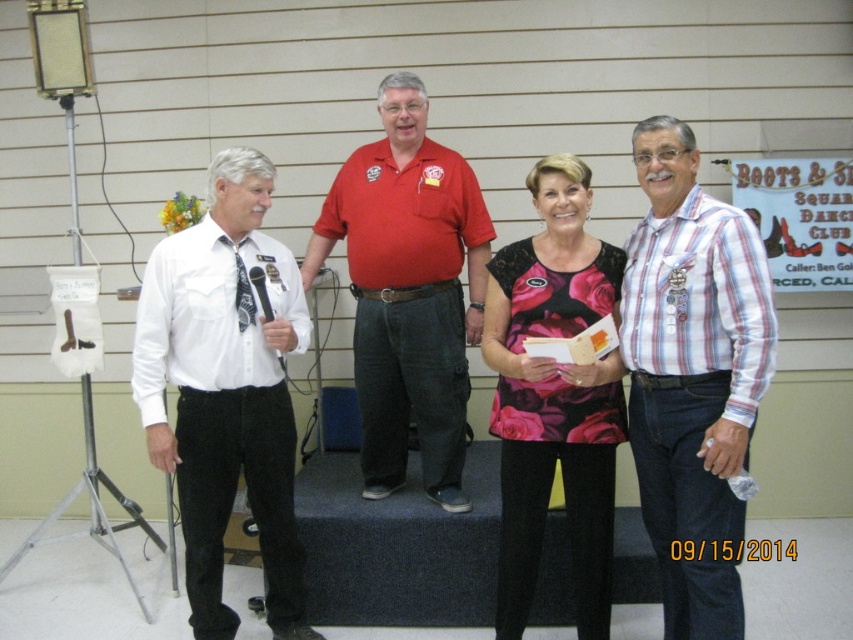
You are a photographer at the event and need to capture a photo of both the striped cotton shirt at right and the white cotton shirt at left. Which shirt should you focus on first to ensure it appears larger in the photo?

The white cotton shirt at left should be focused on first because it is thicker than the striped cotton shirt at right, making it appear larger in the photo.